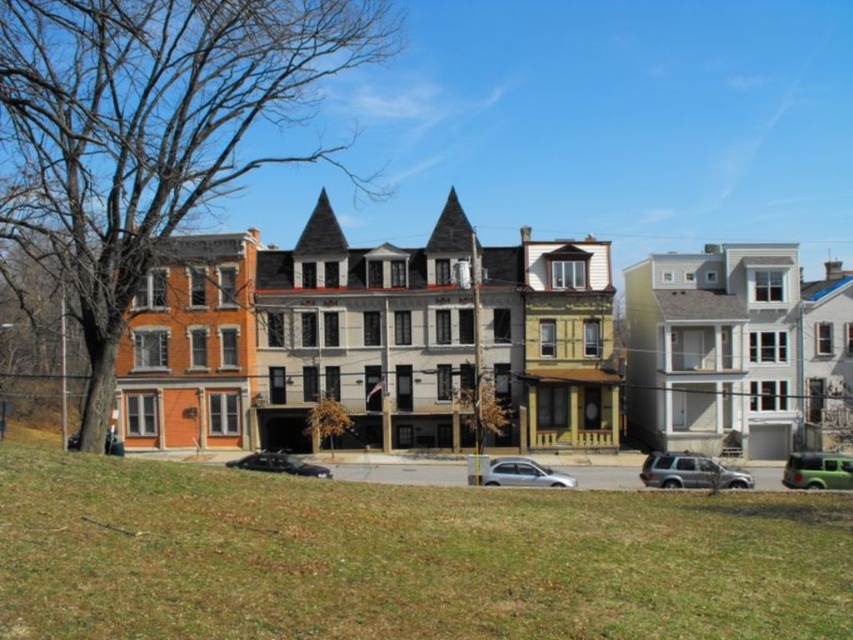
Which of these two, satin silver suv at center or silver metallic sedan at center, stands shorter?

silver metallic sedan at center

Does satin silver suv at center have a greater width compared to silver metallic sedan at center?

Yes, satin silver suv at center is wider than silver metallic sedan at center.

Does point (729, 476) come in front of point (527, 474)?

Yes, point (729, 476) is closer to viewer.

What are the coordinates of `satin silver suv at center` in the screenshot? It's located at (689, 472).

Does silver metallic sedan at center appear under black matte car at center?

Incorrect, silver metallic sedan at center is not positioned below black matte car at center.

Is point (563, 477) positioned after point (286, 468)?

No.

What do you see at coordinates (524, 474) in the screenshot? The width and height of the screenshot is (853, 640). I see `silver metallic sedan at center` at bounding box center [524, 474].

This screenshot has width=853, height=640. Find the location of `silver metallic sedan at center`. silver metallic sedan at center is located at coordinates (524, 474).

Who is taller, green grass at lower center or green matte car at lower right?

green grass at lower center is taller.

Locate an element on the screen. green grass at lower center is located at coordinates (403, 557).